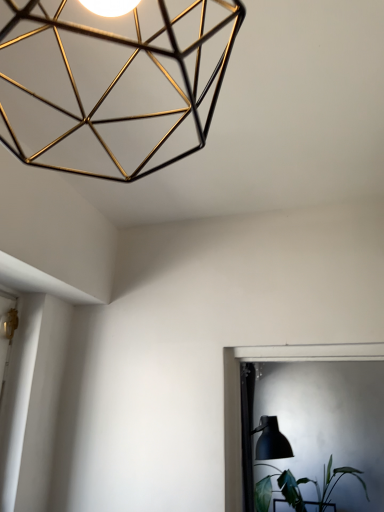
Question: From their relative heights in the image, would you say gold wireframe lamp at upper left is taller or shorter than matte black table lamp at lower right?

Choices:
 (A) short
 (B) tall

Answer: (A)

Question: Considering the relative positions of gold wireframe lamp at upper left and matte black table lamp at lower right in the image provided, is gold wireframe lamp at upper left to the left or to the right of matte black table lamp at lower right?

Choices:
 (A) right
 (B) left

Answer: (B)

Question: Considering the real-world distances, which object is farthest from the green leafy plant at lower right?

Choices:
 (A) gold wireframe lamp at upper left
 (B) matte black table lamp at lower right

Answer: (A)

Question: Estimate the real-world distances between objects in this image. Which object is farther from the gold wireframe lamp at upper left?

Choices:
 (A) matte black table lamp at lower right
 (B) green leafy plant at lower right

Answer: (B)